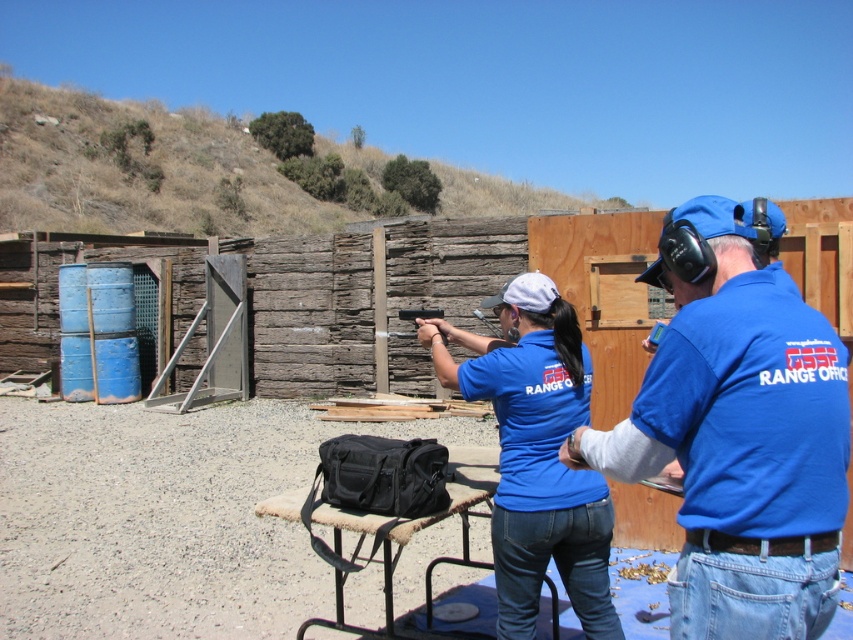
Looking at this image, how far apart are blue cotton shirt at center and matte black rifle at center?

blue cotton shirt at center is 20.71 feet from matte black rifle at center.

I want to click on blue cotton shirt at center, so click(537, 452).

Between point (730, 339) and point (527, 353), which one is positioned in front?

Point (730, 339) is in front.

Is blue cotton shirt at center right further to camera compared to blue cotton shirt at center?

No, it is not.

Between point (726, 520) and point (498, 605), which one is positioned behind?

Positioned behind is point (498, 605).

Where is `blue cotton shirt at center right`? blue cotton shirt at center right is located at coordinates (738, 428).

How distant is blue cotton shirt at center right from matte black rifle at center?

blue cotton shirt at center right is 23.13 feet from matte black rifle at center.

Consider the image. Who is more forward, (711, 387) or (403, 332)?

Point (711, 387) is more forward.

I want to click on blue cotton shirt at center right, so click(x=738, y=428).